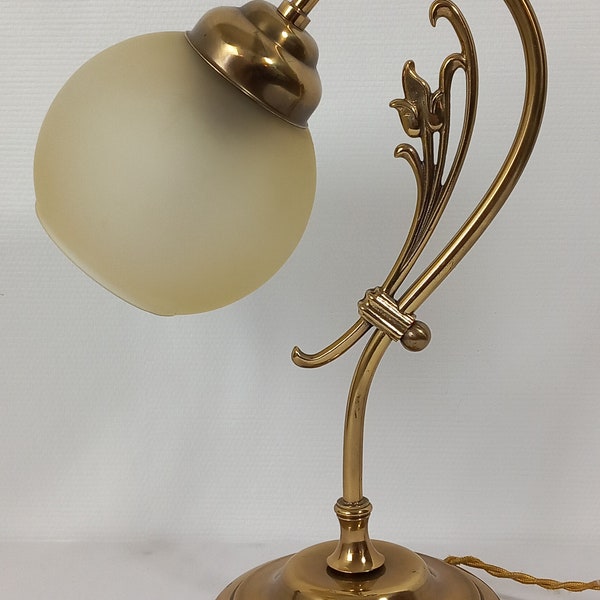
Locate instances of how decoration is held on lamp arm in the image. Your answer should be formatted as a list of tuples, i.e. [(x1, y1), (x2, y2), ...], where each tuple contains the x and y coordinates of a point satisfying the conditions above.

[(384, 321)]